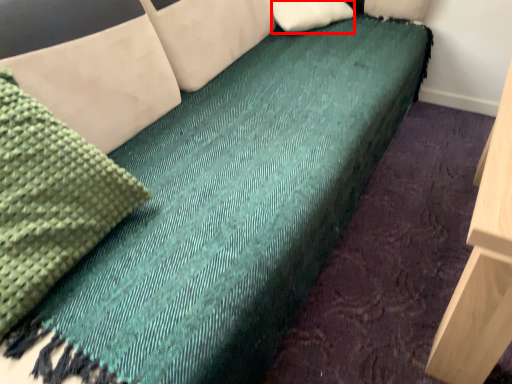
Question: From the image's perspective, what is the correct spatial positioning of pillow (annotated by the red box) in reference to material?

Choices:
 (A) below
 (B) above

Answer: (B)